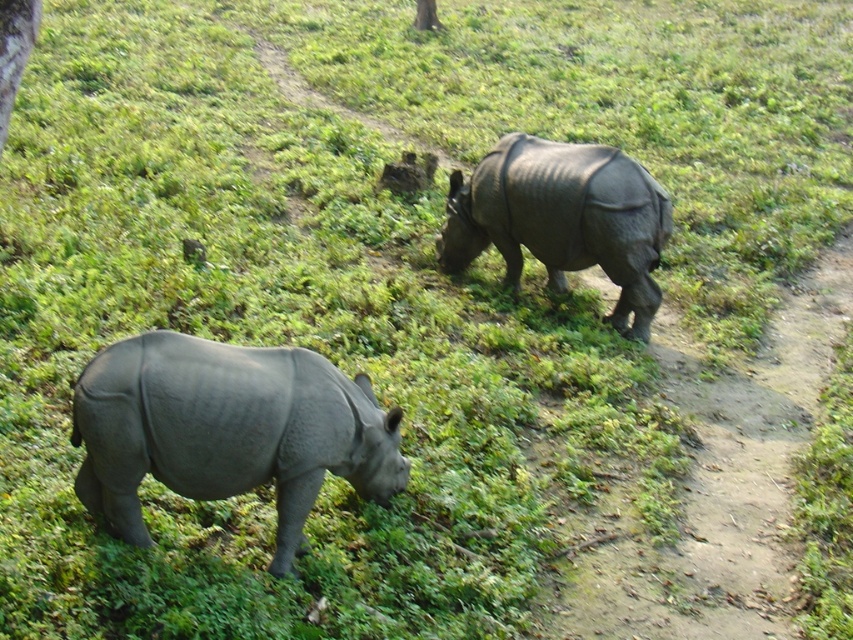
Can you confirm if gray matte rhinoceros at upper right is positioned to the right of green leafy tree at upper left?

Indeed, gray matte rhinoceros at upper right is positioned on the right side of green leafy tree at upper left.

Is gray matte rhinoceros at upper right smaller than green leafy tree at upper left?

Incorrect, gray matte rhinoceros at upper right is not smaller in size than green leafy tree at upper left.

Locate an element on the screen. This screenshot has width=853, height=640. gray matte rhinoceros at upper right is located at coordinates (561, 218).

Find the location of a particular element. gray matte rhinoceros at upper right is located at coordinates (561, 218).

Does gray matte rhinoceros at lower left appear under green leafy tree at upper left?

Correct, gray matte rhinoceros at lower left is located below green leafy tree at upper left.

I want to click on gray matte rhinoceros at lower left, so click(x=227, y=429).

Where is `gray matte rhinoceros at lower left`? This screenshot has height=640, width=853. gray matte rhinoceros at lower left is located at coordinates (227, 429).

Between gray matte rhinoceros at lower left and gray matte rhinoceros at upper right, which one appears on the left side from the viewer's perspective?

Positioned to the left is gray matte rhinoceros at lower left.

At what (x,y) coordinates should I click in order to perform the action: click on gray matte rhinoceros at lower left. Please return your answer as a coordinate pair (x, y). The image size is (853, 640). Looking at the image, I should click on click(227, 429).

Find the location of a particular element. This screenshot has width=853, height=640. gray matte rhinoceros at lower left is located at coordinates (227, 429).